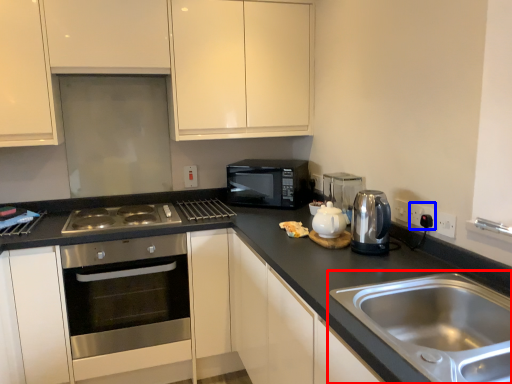
Question: Which object appears closest to the camera in this image, sink (highlighted by a red box) or electric outlet (highlighted by a blue box)?

Choices:
 (A) sink
 (B) electric outlet

Answer: (A)